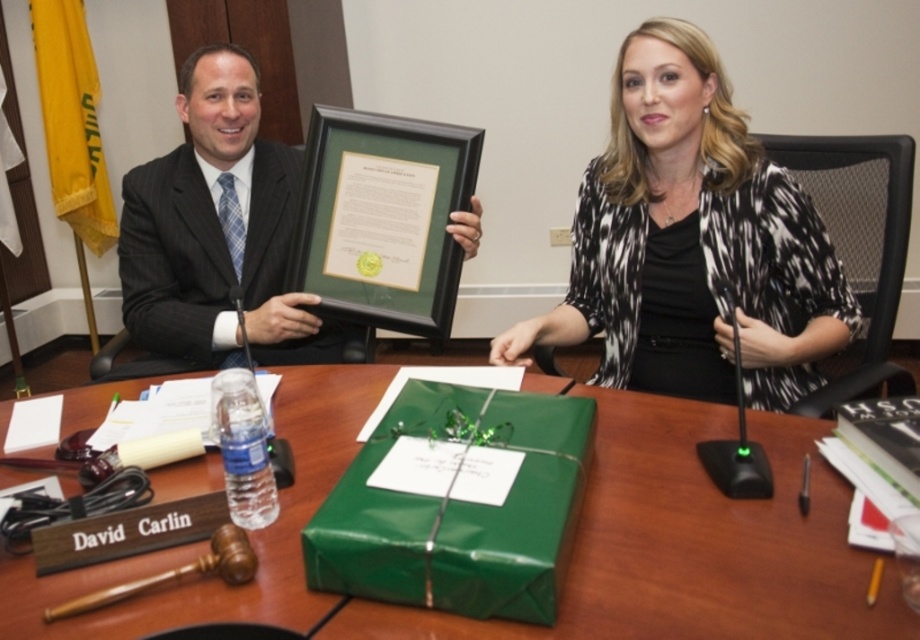
Question: Estimate the real-world distances between objects in this image. Which object is closer to the matte black suit at center?

Choices:
 (A) green paper wrapped gift at center
 (B) dark gray pinstripe suit at left
 (C) black and white printed blouse at center

Answer: (B)

Question: Can you confirm if green paper wrapped gift at center is positioned below black and white printed blouse at center?

Choices:
 (A) no
 (B) yes

Answer: (B)

Question: Which is nearer to the dark gray pinstripe suit at left?

Choices:
 (A) matte black suit at center
 (B) black and white printed blouse at center

Answer: (A)

Question: Is black and white printed blouse at center to the right of matte black suit at center from the viewer's perspective?

Choices:
 (A) yes
 (B) no

Answer: (A)

Question: Can you confirm if black and white printed blouse at center is positioned above matte black suit at center?

Choices:
 (A) yes
 (B) no

Answer: (B)

Question: Which object is closer to the camera taking this photo?

Choices:
 (A) green paper wrapped gift at center
 (B) black and white printed blouse at center
 (C) dark gray pinstripe suit at left

Answer: (A)